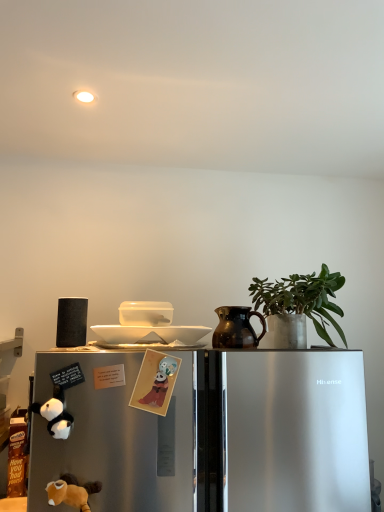
Question: From the image's perspective, is sleek metallic refrigerator at lower left located beneath black matte speaker at left, acting as the second appliance starting from the right?

Choices:
 (A) yes
 (B) no

Answer: (A)

Question: Is sleek metallic refrigerator at lower left to the right of black matte speaker at left, the 1th appliance in the left-to-right sequence, from the viewer's perspective?

Choices:
 (A) yes
 (B) no

Answer: (A)

Question: From the image's perspective, is sleek metallic refrigerator at lower left over black matte speaker at left, the 1th appliance in the left-to-right sequence?

Choices:
 (A) yes
 (B) no

Answer: (B)

Question: Does sleek metallic refrigerator at lower left come in front of black matte speaker at left, acting as the second appliance starting from the right?

Choices:
 (A) yes
 (B) no

Answer: (A)

Question: Considering the relative sizes of sleek metallic refrigerator at lower left and black matte speaker at left, the 1th appliance in the left-to-right sequence, in the image provided, is sleek metallic refrigerator at lower left wider than black matte speaker at left, the 1th appliance in the left-to-right sequence,?

Choices:
 (A) no
 (B) yes

Answer: (B)

Question: From the image's perspective, is matte paper card at center, which appears as the 1th animal when viewed from the right, positioned above or below soft plush toy at lower left, the 1th animal from the bottom?

Choices:
 (A) below
 (B) above

Answer: (B)

Question: Is matte paper card at center, which appears as the 1th animal when viewed from the right, wider or thinner than soft plush toy at lower left, the 1th animal from the bottom?

Choices:
 (A) wide
 (B) thin

Answer: (B)

Question: Considering the positions of point (178, 360) and point (48, 482), is point (178, 360) closer or farther from the camera than point (48, 482)?

Choices:
 (A) farther
 (B) closer

Answer: (A)

Question: In terms of height, does matte paper card at center, which is counted as the 3th animal, starting from the bottom, look taller or shorter compared to soft plush toy at lower left, the 1th animal from the bottom?

Choices:
 (A) tall
 (B) short

Answer: (A)

Question: From the image's perspective, is soft plush toy at lower left, which appears as the 2th animal when viewed from the left, positioned above or below sleek metallic refrigerator at lower left?

Choices:
 (A) above
 (B) below

Answer: (A)

Question: From a real-world perspective, is soft plush toy at lower left, the 1th animal from the bottom, above or below sleek metallic refrigerator at lower left?

Choices:
 (A) above
 (B) below

Answer: (A)

Question: Is soft plush toy at lower left, acting as the third animal starting from the top, bigger or smaller than sleek metallic refrigerator at lower left?

Choices:
 (A) small
 (B) big

Answer: (A)

Question: Considering the positions of soft plush toy at lower left, which appears as the 2th animal when viewed from the left, and sleek metallic refrigerator at lower left in the image, is soft plush toy at lower left, which appears as the 2th animal when viewed from the left, wider or thinner than sleek metallic refrigerator at lower left?

Choices:
 (A) thin
 (B) wide

Answer: (A)

Question: Considering the positions of black plush toy at lower left, the first animal in the left-to-right sequence, and sleek metallic refrigerator at lower left in the image, is black plush toy at lower left, the first animal in the left-to-right sequence, wider or thinner than sleek metallic refrigerator at lower left?

Choices:
 (A) thin
 (B) wide

Answer: (A)

Question: Is black plush toy at lower left, acting as the third animal starting from the right, bigger or smaller than sleek metallic refrigerator at lower left?

Choices:
 (A) small
 (B) big

Answer: (A)